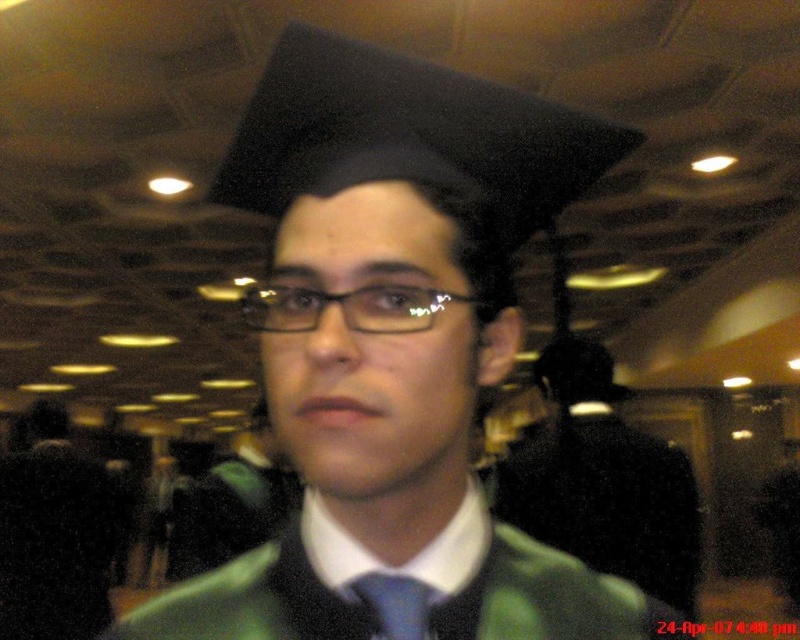
Does green matte graduation gown at center have a lesser width compared to black plastic glasses at center?

In fact, green matte graduation gown at center might be wider than black plastic glasses at center.

Describe the element at coordinates (601, 481) in the screenshot. I see `green matte graduation gown at center` at that location.

Is point (692, 604) positioned before point (385, 324)?

No, it is behind (385, 324).

Find the location of a particular element. This screenshot has height=640, width=800. green matte graduation gown at center is located at coordinates (601, 481).

Who is positioned more to the right, matte black graduation cap at upper center or black plastic glasses at center?

matte black graduation cap at upper center is more to the right.

Is matte black graduation cap at upper center wider than black plastic glasses at center?

Indeed, matte black graduation cap at upper center has a greater width compared to black plastic glasses at center.

Who is more forward, [341,282] or [246,312]?

Point [341,282] is in front.

The width and height of the screenshot is (800, 640). Find the location of `matte black graduation cap at upper center`. matte black graduation cap at upper center is located at coordinates (397, 348).

Between matte black graduation cap at upper center and blue silk tie at center, which one has more height?

matte black graduation cap at upper center

Between point (464, 513) and point (428, 604), which one is positioned behind?

Point (464, 513)

Is point (285, 630) more distant than point (376, 609)?

That is True.

Identify the location of matte black graduation cap at upper center. Image resolution: width=800 pixels, height=640 pixels. (397, 348).